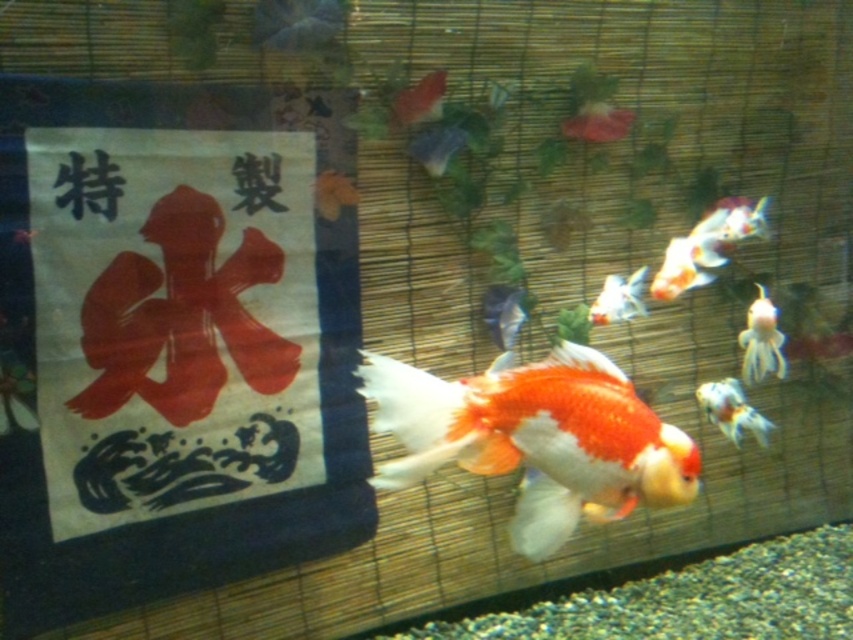
You are standing in front of the fish tank and see two points marked in the image. Which point is closer to you, point (537,433) or point (778,332)?

Point (537,433) is in front of point (778,332), so it is closer to you.

You are standing in front of the fish tank and want to know how far the point at coordinates point (779, 376) is from you. Can you determine the distance?

The point (779, 376) is 1.91 meters away from the viewer.

You are an aquarium maintenance worker who needs to identify the taller fish between the white glossy goldfish at right and the orange glossy goldfish at lower right. Which one is taller?

The white glossy goldfish at right is much taller than the orange glossy goldfish at lower right according to the description.